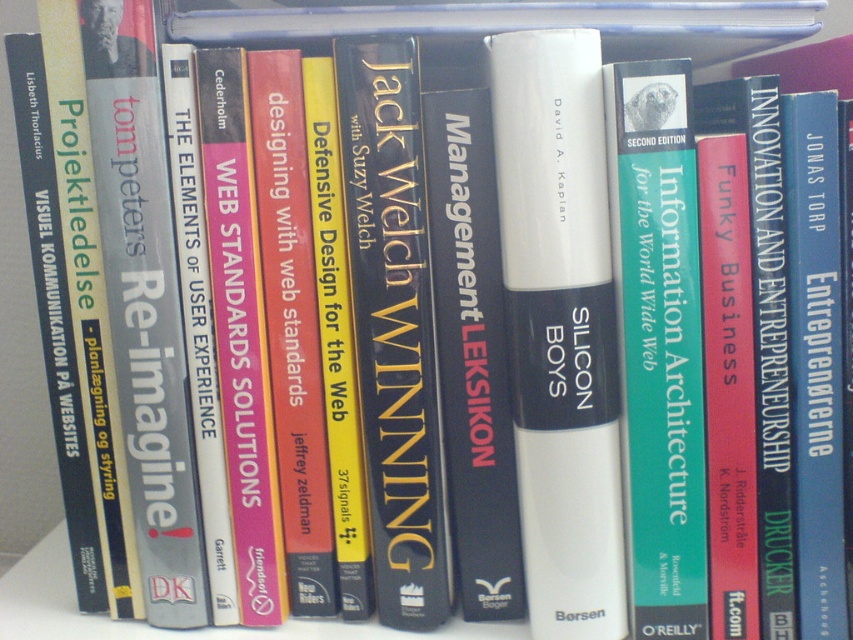
You are organizing a bookshelf and need to place the green matte book at center and the hardcover book at center. According to the image, which book should be placed lower on the shelf?

The green matte book at center should be placed lower on the shelf because it is located below the hardcover book at center in the image.

You are organizing a bookshelf and need to place the white matte book at center and the green matte book at center. According to the image, which book should be placed higher on the shelf?

The white matte book at center should be placed higher on the shelf because it is positioned above the green matte book at center in the image.

You are organizing a bookshelf and need to place the white matte book at center and the green matte book at center. Given their sizes, which book should you place first to ensure they fit properly?

The white matte book at center has a larger width than the green matte book at center, so you should place the white matte book at center first to accommodate its size before placing the smaller green matte book at center.